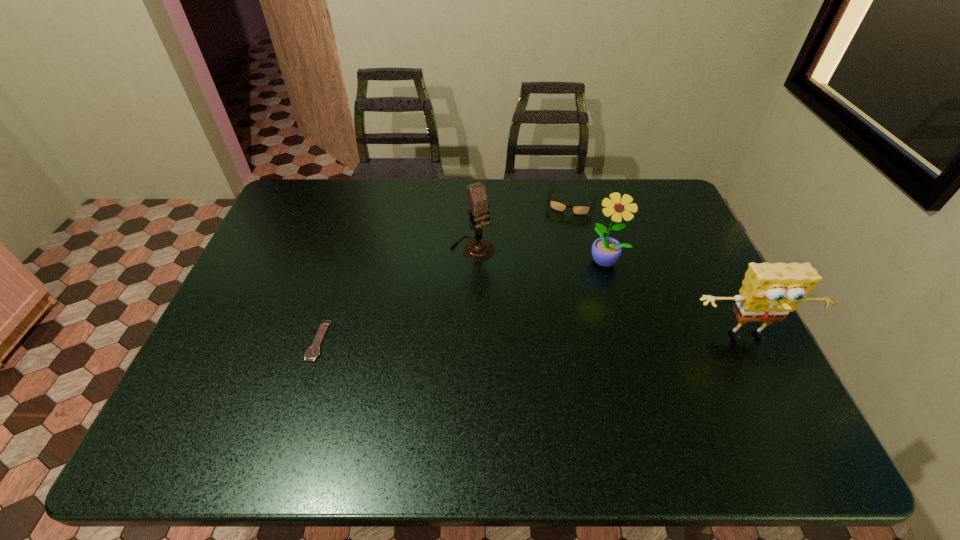
Image resolution: width=960 pixels, height=540 pixels. I want to click on watch, so click(x=313, y=351).

In order to click on the shortest object in this screenshot , I will do `click(313, 351)`.

Find the location of a particular element. Image resolution: width=960 pixels, height=540 pixels. sponge is located at coordinates (769, 292).

This screenshot has width=960, height=540. I want to click on the second object from left to right, so click(478, 249).

At what (x,y) coordinates should I click in order to perform the action: click on sunglasses. Please return your answer as a coordinate pair (x, y). The image size is (960, 540). Looking at the image, I should click on tap(559, 206).

Locate an element on the screen. This screenshot has width=960, height=540. the farthest object is located at coordinates (559, 206).

What are the coordinates of `sunflower` in the screenshot? It's located at (606, 251).

I want to click on free space located on the back of the shortest object, so click(352, 231).

Identify the location of free location located on the face of the rightmost object. (765, 373).

Locate an element on the screen. The image size is (960, 540). free region located on the front-facing side of the second object from left to right is located at coordinates (540, 331).